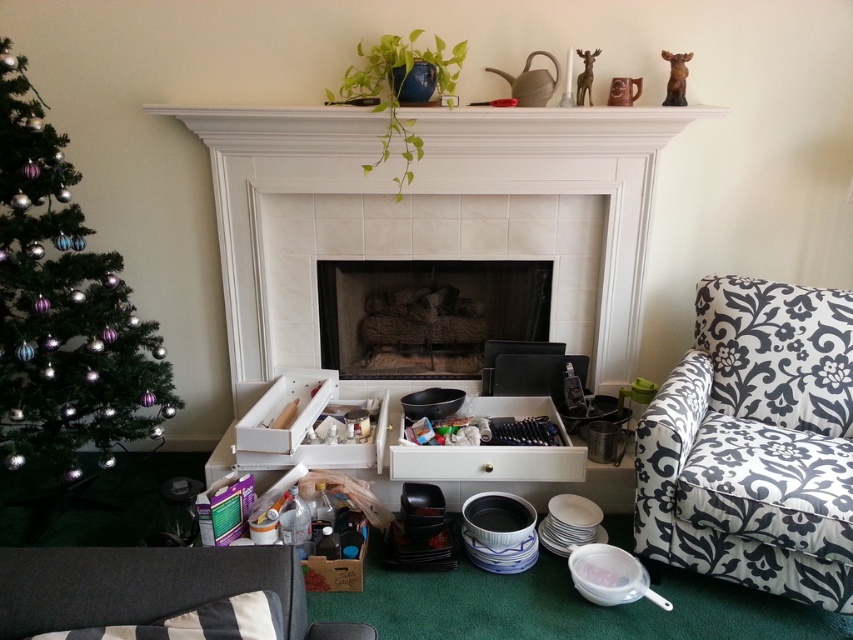
You are sitting in the living room and want to move from the dark gray fabric couch at lower left to the black floral fabric armchair at right. Which direction should you move to reach the armchair?

The black floral fabric armchair at right is positioned over the dark gray fabric couch at lower left, so you should move upwards to reach the armchair.

You are sitting on the dark gray fabric couch at lower left and want to reach the green matte christmas tree at left. Which direction should you move to get closer to the tree?

Since the green matte christmas tree at left is located above the dark gray fabric couch at lower left, you should move forward towards the tree to get closer.

You are planning to place a new rectangular coffee table in the living room. The coffee table is 1.2 meters wide. You want to position it between the black floral fabric armchair at right and the dark gray fabric couch at lower left. Is the space between them wide enough to accommodate the coffee table?

The space between the black floral fabric armchair at right and the dark gray fabric couch at lower left is wider than 1.2 meters since the armchair is larger in width than the couch. Therefore, the coffee table can fit comfortably between them.